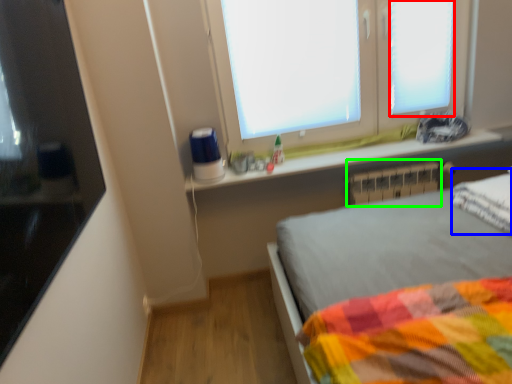
Question: Which is nearer to the window frame (highlighted by a red box)? pillow (highlighted by a blue box) or radiator (highlighted by a green box).

Choices:
 (A) pillow
 (B) radiator

Answer: (B)